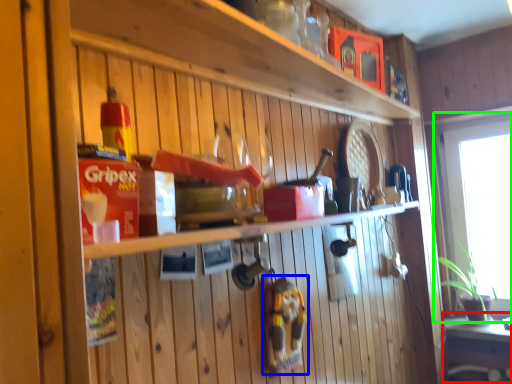
Question: Based on their relative distances, which object is farther from table (highlighted by a red box)? Choose from toy (highlighted by a blue box) and window (highlighted by a green box).

Choices:
 (A) toy
 (B) window

Answer: (A)